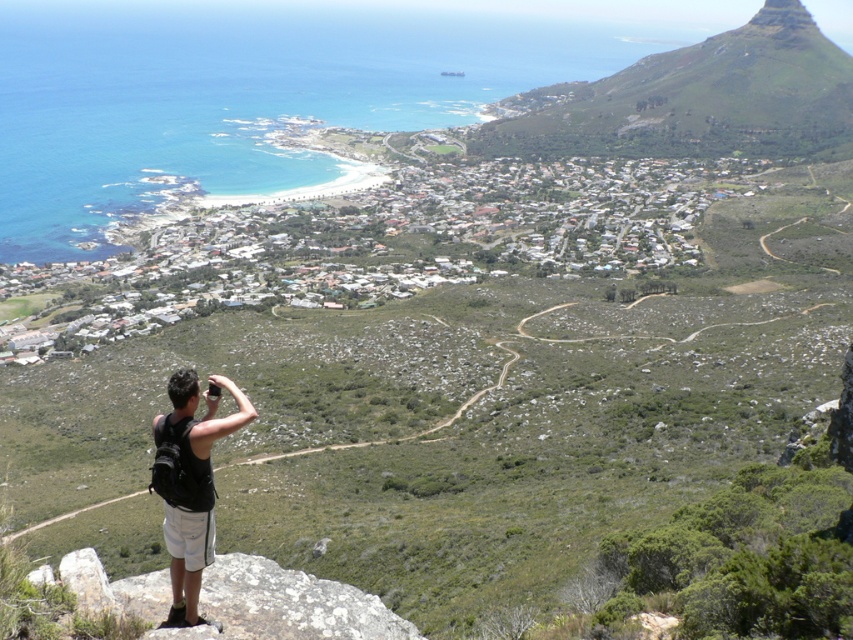
You are standing at the rocky outcrop and want to take a photo that includes both the green grassy mountain at upper right and the black fabric backpack at lower left. Which object should you position closer to the edge of your camera frame to ensure both are visible?

You should position the black fabric backpack at lower left closer to the edge of your camera frame because the green grassy mountain at upper right is on the right side of the backpack, so centering the backpack might cut off the mountain.

You are a drone operator trying to capture a photo of the coastal town. You notice two points marked in the scene. The first point is at coordinate [824,102] and the second is at [181,572]. Which point is closer to your drone camera position?

Point [181,572] is closer to the drone camera position because it is less further than point [824,102] according to the description.

You are standing on the rocky outcrop and want to take a photo that includes both the green grassy mountain at upper right and the black fabric backpack at lower left. Which object should you position closer to the edge of your camera frame to ensure both are visible?

You should position the black fabric backpack at lower left closer to the edge of your camera frame because the green grassy mountain at upper right is located above it, so adjusting the backpack towards the lower edge will help include both in the frame.